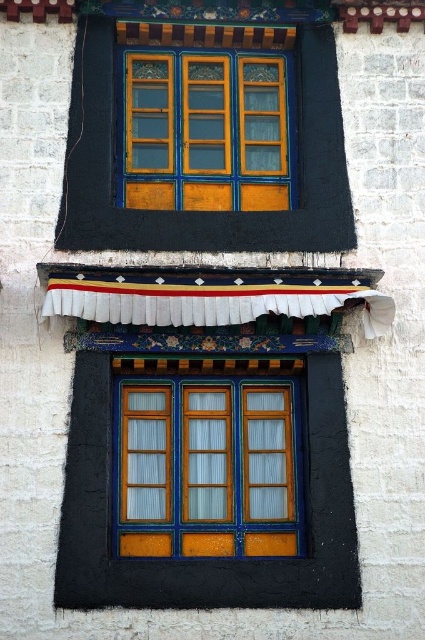
You are an architect examining the traditional building. You notice the matte wood window frame at center and the wooden at lower center. Based on their positions, which object is located to the right side of the other?

The matte wood window frame at center is to the right of wooden at lower center.

You are an architect designing a replica of this traditional building. You need to ensure the proportions between the matte wood window frame at center and the wooden at lower center are accurate. Which one should you make wider in your design?

The matte wood window frame at center should be made wider than the wooden at lower center in the design since the matte wood window frame at center has a larger width according to the description.

You are standing in front of the traditional Tibetan building and want to determine the spatial relationship between two specific points marked on the structure. Which of the two points, point (x=169, y=396) or point (x=252, y=92), is closer to you?

Point (x=169, y=396) is closer to the viewer than point (x=252, y=92).